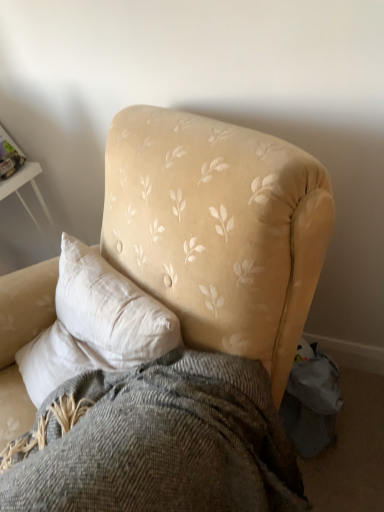
Question: From the image's perspective, is textured gray blanket at center below velvet yellow armchair at center?

Choices:
 (A) no
 (B) yes

Answer: (B)

Question: Can you confirm if textured gray blanket at center is taller than velvet yellow armchair at center?

Choices:
 (A) yes
 (B) no

Answer: (B)

Question: Is textured gray blanket at center oriented away from velvet yellow armchair at center?

Choices:
 (A) yes
 (B) no

Answer: (A)

Question: Is velvet yellow armchair at center inside textured gray blanket at center?

Choices:
 (A) yes
 (B) no

Answer: (B)

Question: Considering the relative positions of textured gray blanket at center and velvet yellow armchair at center in the image provided, is textured gray blanket at center to the right of velvet yellow armchair at center from the viewer's perspective?

Choices:
 (A) no
 (B) yes

Answer: (B)

Question: Does textured gray blanket at center come in front of velvet yellow armchair at center?

Choices:
 (A) yes
 (B) no

Answer: (B)

Question: Is velvet yellow armchair at center at the right side of textured gray blanket at center?

Choices:
 (A) no
 (B) yes

Answer: (A)

Question: Is textured gray blanket at center completely or partially inside velvet yellow armchair at center?

Choices:
 (A) no
 (B) yes

Answer: (B)

Question: Does velvet yellow armchair at center have a smaller size compared to textured gray blanket at center?

Choices:
 (A) yes
 (B) no

Answer: (B)

Question: Is velvet yellow armchair at center taller than textured gray blanket at center?

Choices:
 (A) yes
 (B) no

Answer: (A)

Question: Considering the relative sizes of velvet yellow armchair at center and textured gray blanket at center in the image provided, is velvet yellow armchair at center shorter than textured gray blanket at center?

Choices:
 (A) no
 (B) yes

Answer: (A)

Question: Considering the relative positions of velvet yellow armchair at center and textured gray blanket at center in the image provided, is velvet yellow armchair at center in front of textured gray blanket at center?

Choices:
 (A) no
 (B) yes

Answer: (B)

Question: In terms of height, does textured gray blanket at center look taller or shorter compared to velvet yellow armchair at center?

Choices:
 (A) tall
 (B) short

Answer: (B)